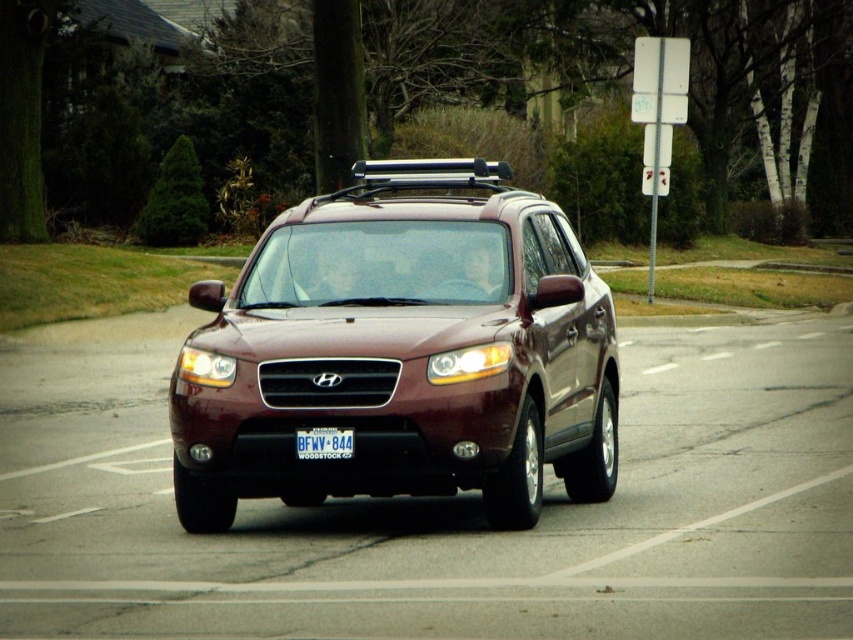
In the scene shown: You are a driver approaching a crosswalk while driving a satin burgundy suv at center. Your vehicle is 8 meters away from the crosswalk. Can you safely stop before reaching the crosswalk if the stopping distance required is 7 meters?

The satin burgundy suv at center is 8.19 meters away from the camera. Since the stopping distance required is 7 meters and the distance to the crosswalk is 8 meters, the driver can safely stop before reaching the crosswalk.

You are a driver who needs to check the license plate number of the satin burgundy suv at center. Since the white plastic license plate at center is small, can you read the number clearly from your current position?

The satin burgundy suv at center is larger in size than the white plastic license plate at center, but the license plate size is still standard for readability. However, since the question mentions the license plate is small, it might be difficult to read the number clearly from a distance without magnification.

Based on the photo, you are a parking attendant who needs to ensure that the satin burgundy suv at center can fit into a parking spot designed for vehicles no wider than the white plastic license plate at center. Based on the scene, can the suv fit into the spot?

The satin burgundy suv at center might be wider than white plastic license plate at center, so there is a possibility that the suv may not fit into the parking spot designed for vehicles no wider than the license plate.